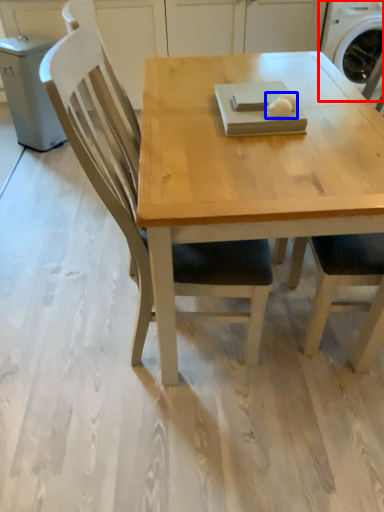
Question: Which of the following is the closest to the observer, washing machine (highlighted by a red box) or food (highlighted by a blue box)?

Choices:
 (A) washing machine
 (B) food

Answer: (B)